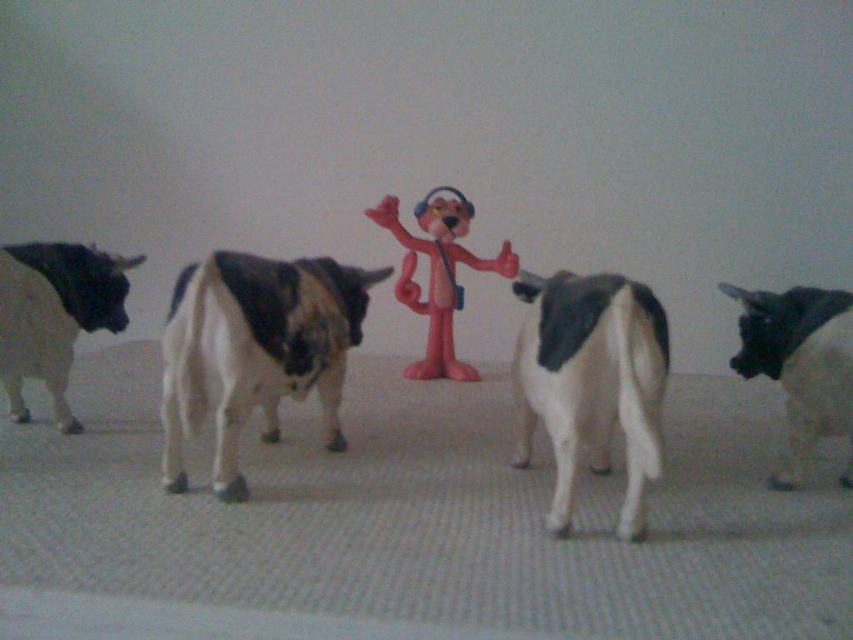
Question: Which point is farther to the camera?

Choices:
 (A) black and white plastic cow at left
 (B) black glossy bull at right

Answer: (A)

Question: Which object is closer to the camera taking this photo?

Choices:
 (A) black glossy bull at right
 (B) black and white plastic bull at center

Answer: (B)

Question: Which of the following is the farthest from the observer?

Choices:
 (A) black glossy bull at right
 (B) black and white plastic cow at left
 (C) pink plastic toy at center

Answer: (C)

Question: Does black and white plastic cow at left appear over pink plastic toy at center?

Choices:
 (A) yes
 (B) no

Answer: (B)

Question: Does black and white plastic bull at center have a smaller size compared to black glossy bull at right?

Choices:
 (A) yes
 (B) no

Answer: (B)

Question: Observing the image, what is the correct spatial positioning of black and white plastic cow at center in reference to black and white plastic cow at left?

Choices:
 (A) left
 (B) right

Answer: (B)